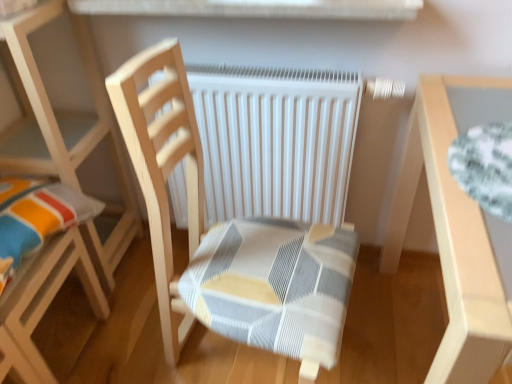
Question: Does wooden chair at left, the first chair viewed from the left, have a greater height compared to light wood table at right?

Choices:
 (A) yes
 (B) no

Answer: (A)

Question: From a real-world perspective, is wooden chair at left, the first chair viewed from the left, on light wood table at right?

Choices:
 (A) yes
 (B) no

Answer: (A)

Question: From a real-world perspective, is wooden chair at left, the first chair viewed from the left, located beneath light wood table at right?

Choices:
 (A) no
 (B) yes

Answer: (A)

Question: Does wooden chair at left, the first chair viewed from the left, lie behind light wood table at right?

Choices:
 (A) yes
 (B) no

Answer: (A)

Question: Is wooden chair at left, the first chair viewed from the left, to the right of light wood table at right from the viewer's perspective?

Choices:
 (A) no
 (B) yes

Answer: (A)

Question: In terms of size, does white matte radiator at center appear bigger or smaller than white smooth window sill at upper center?

Choices:
 (A) small
 (B) big

Answer: (B)

Question: Visually, is white matte radiator at center positioned to the left or to the right of white smooth window sill at upper center?

Choices:
 (A) left
 (B) right

Answer: (B)

Question: Considering the positions of point (281, 76) and point (415, 11), is point (281, 76) closer or farther from the camera than point (415, 11)?

Choices:
 (A) farther
 (B) closer

Answer: (A)

Question: In terms of width, does white matte radiator at center look wider or thinner when compared to white smooth window sill at upper center?

Choices:
 (A) thin
 (B) wide

Answer: (A)

Question: In terms of width, does white matte radiator at center look wider or thinner when compared to light wood table at right?

Choices:
 (A) thin
 (B) wide

Answer: (A)

Question: Based on their positions, is white matte radiator at center located to the left or right of light wood table at right?

Choices:
 (A) right
 (B) left

Answer: (B)

Question: Looking at the image, does white matte radiator at center seem bigger or smaller compared to light wood table at right?

Choices:
 (A) big
 (B) small

Answer: (B)

Question: From the image's perspective, is white matte radiator at center above or below light wood table at right?

Choices:
 (A) below
 (B) above

Answer: (B)

Question: Is light wood table at right wider or thinner than wooden chair at left, the 2th chair in the right-to-left sequence?

Choices:
 (A) wide
 (B) thin

Answer: (A)

Question: From a real-world perspective, is light wood table at right positioned above or below wooden chair at left, the first chair viewed from the left?

Choices:
 (A) above
 (B) below

Answer: (B)